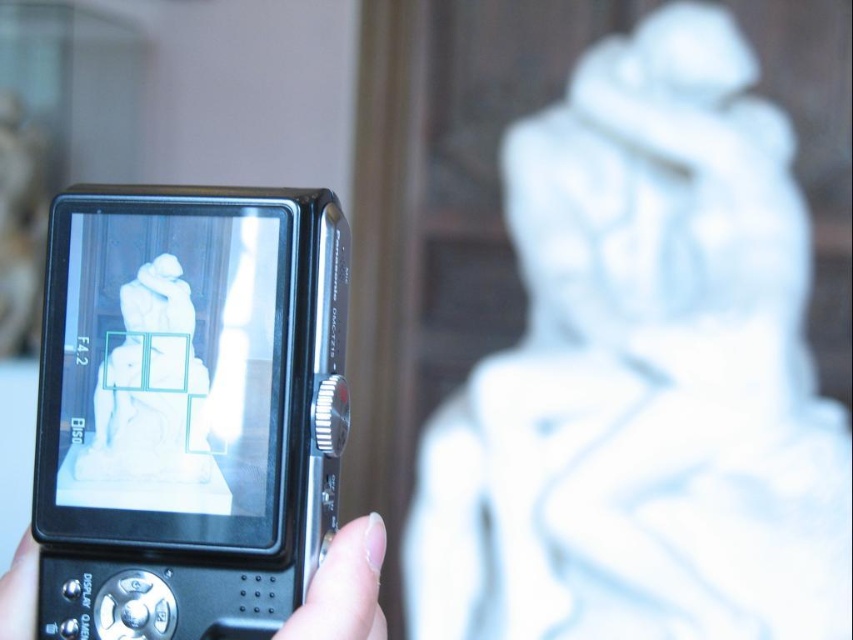
You are a photographer trying to capture the white marble statue at center and the nail polish at lower center in the same frame. Based on their positions, which object should you focus on first to ensure both are in sharp focus?

The white marble statue at center is further to the viewer than the nail polish at lower center. To ensure both are in sharp focus, you should focus on the white marble statue at center first, as it is closer to the camera, which will help include the nail polish at lower center within the depth of field.

You are a photographer trying to capture the white marble statue at center and the black plastic camera at center in a single frame. Based on their sizes, which object will appear larger in the final photo?

The white marble statue at center will appear much larger in the final photo because it is much taller than the black plastic camera at center.